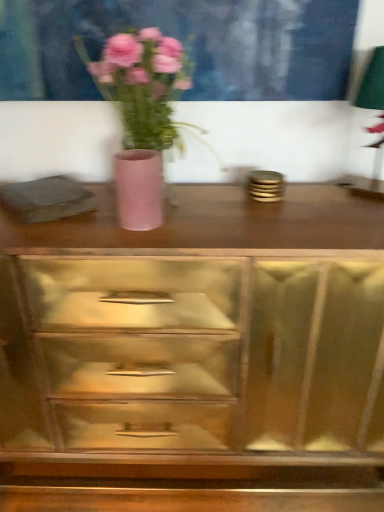
Question: From the image's perspective, relative to pink matte vase at center, is matte pink vase at center above or below?

Choices:
 (A) below
 (B) above

Answer: (A)

Question: From a real-world perspective, is matte pink vase at center positioned above or below pink matte vase at center?

Choices:
 (A) below
 (B) above

Answer: (A)

Question: Based on their relative distances, which object is farther from the matte pink vase at center?

Choices:
 (A) pink matte vase at center
 (B) wooden chest of drawers at center

Answer: (B)

Question: Estimate the real-world distances between objects in this image. Which object is farther from the wooden chest of drawers at center?

Choices:
 (A) pink matte vase at center
 (B) matte pink vase at center

Answer: (B)